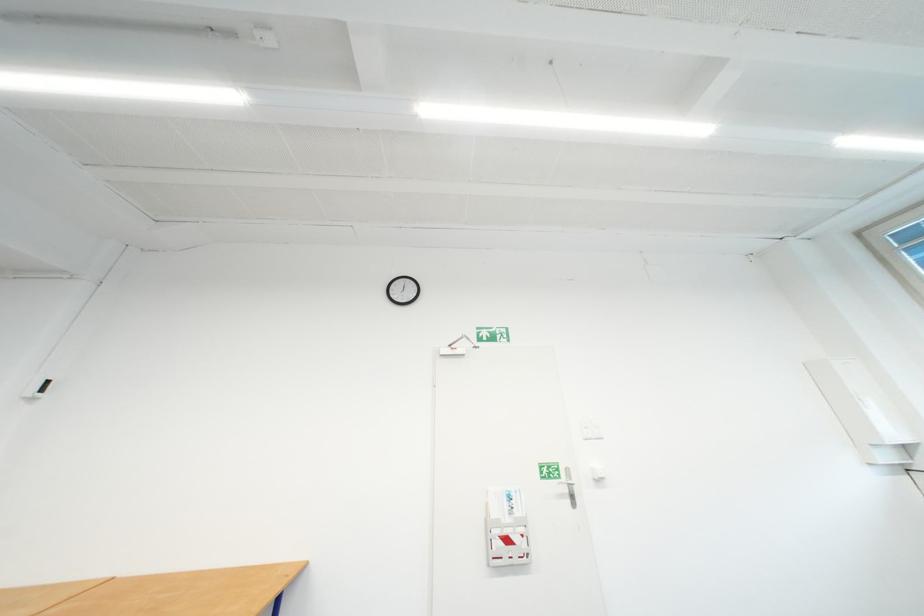
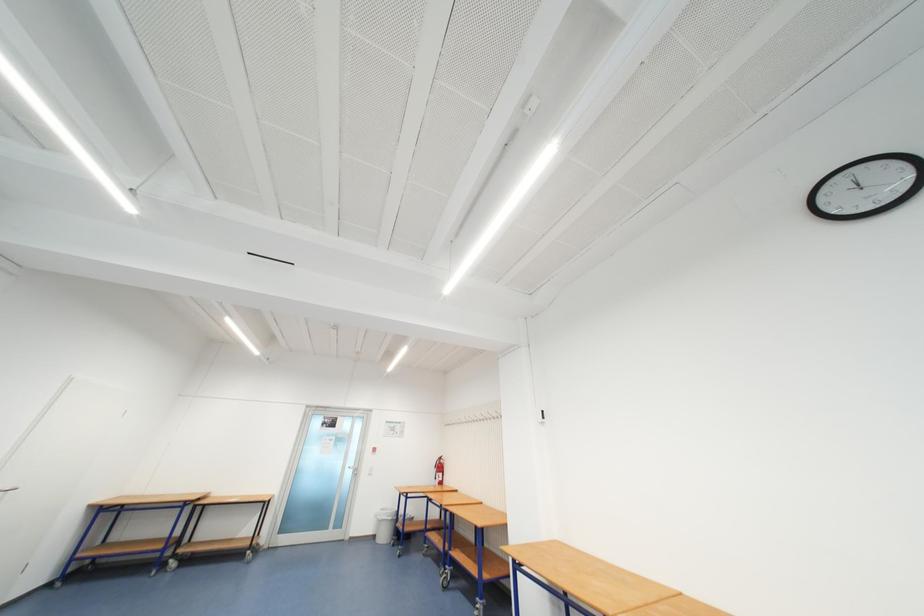
The images are taken continuously from a first-person perspective. In which direction is your viewpoint rotating?

The rotation direction of the camera is left-up.